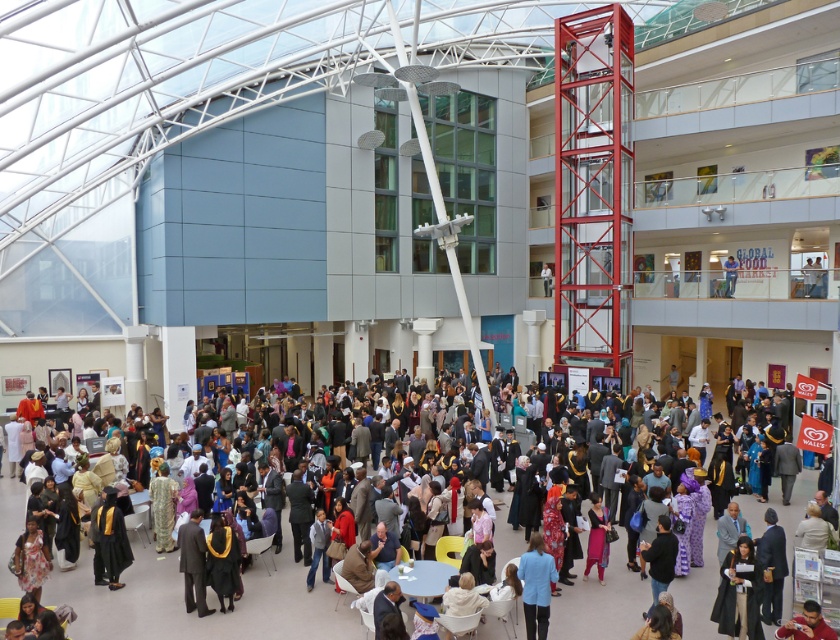
Question: Does matte black graduation gown at center appear under matte black suit at center?

Choices:
 (A) yes
 (B) no

Answer: (A)

Question: Does blue fabric jacket at lower center appear under matte black suit at center?

Choices:
 (A) no
 (B) yes

Answer: (B)

Question: Among these points, which one is nearest to the camera?

Choices:
 (A) (723, 280)
 (B) (528, 595)
 (C) (84, 540)

Answer: (B)

Question: Considering the real-world distances, which object is closest to the blue fabric jacket at lower center?

Choices:
 (A) matte black suit at center
 (B) matte black graduation gown at center

Answer: (B)

Question: Which point is closer to the camera taking this photo?

Choices:
 (A) (353, 616)
 (B) (546, 589)
 (C) (727, 280)

Answer: (B)

Question: Does blue fabric jacket at lower center have a smaller size compared to matte black suit at center?

Choices:
 (A) yes
 (B) no

Answer: (B)